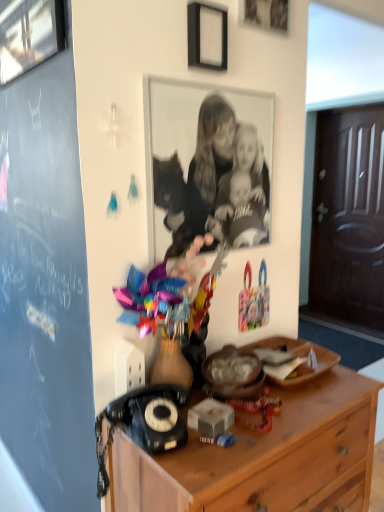
Question: Is black matte picture frame at upper center, which is the second picture frame from right to left, not within brushed metal picture frame at upper left, which ranks as the 1th picture frame in left-to-right order?

Choices:
 (A) no
 (B) yes

Answer: (B)

Question: Is brushed metal picture frame at upper left, positioned as the 3th picture frame in right-to-left order, at the back of black matte picture frame at upper center, the 2th picture frame in the left-to-right sequence?

Choices:
 (A) yes
 (B) no

Answer: (B)

Question: Is black matte picture frame at upper center, the 2th picture frame in the left-to-right sequence, to the right of brushed metal picture frame at upper left, which ranks as the 1th picture frame in left-to-right order, from the viewer's perspective?

Choices:
 (A) yes
 (B) no

Answer: (A)

Question: Is black matte picture frame at upper center, which is the second picture frame from right to left, with brushed metal picture frame at upper left, positioned as the 3th picture frame in right-to-left order?

Choices:
 (A) yes
 (B) no

Answer: (B)

Question: Does black matte picture frame at upper center, the 2th picture frame in the left-to-right sequence, appear on the left side of brushed metal picture frame at upper left, positioned as the 3th picture frame in right-to-left order?

Choices:
 (A) yes
 (B) no

Answer: (B)

Question: From the image's perspective, is black matte picture frame at upper center, which is the second picture frame from right to left, located beneath brushed metal picture frame at upper left, positioned as the 3th picture frame in right-to-left order?

Choices:
 (A) yes
 (B) no

Answer: (A)

Question: Can you confirm if black plastic rotary phone at lower left is shorter than black and white photograph of family at center?

Choices:
 (A) no
 (B) yes

Answer: (B)

Question: From a real-world perspective, is black plastic rotary phone at lower left on top of black and white photograph of family at center?

Choices:
 (A) yes
 (B) no

Answer: (B)

Question: From the image's perspective, is black plastic rotary phone at lower left beneath black and white photograph of family at center?

Choices:
 (A) no
 (B) yes

Answer: (B)

Question: Is black plastic rotary phone at lower left positioned with its back to black and white photograph of family at center?

Choices:
 (A) yes
 (B) no

Answer: (B)

Question: Is black plastic rotary phone at lower left bigger than black and white photograph of family at center?

Choices:
 (A) no
 (B) yes

Answer: (B)

Question: From a real-world perspective, is black plastic rotary phone at lower left physically below black and white photograph of family at center?

Choices:
 (A) no
 (B) yes

Answer: (B)

Question: From a real-world perspective, is wooden chest of drawers at lower right on wooden plate at center?

Choices:
 (A) no
 (B) yes

Answer: (A)